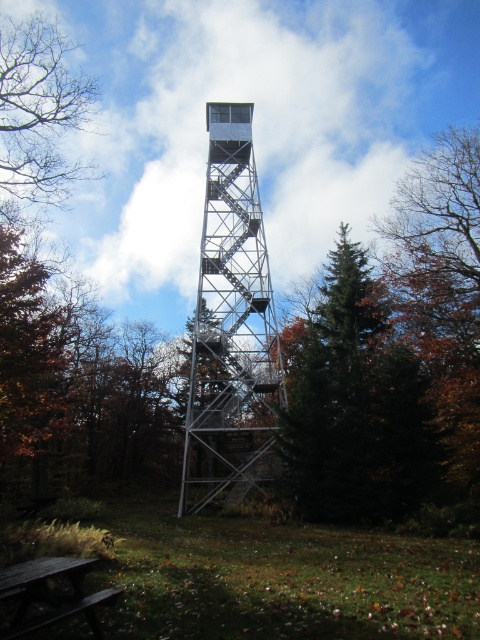
Is metallic silver tower at center above dark brown wooden picnic table at lower left?

Yes, metallic silver tower at center is above dark brown wooden picnic table at lower left.

Between metallic silver tower at center and dark brown wooden picnic table at lower left, which one is positioned lower?

→ dark brown wooden picnic table at lower left is below.

Is point (216, 392) positioned in front of point (97, 595)?

No, it is not.

Identify the location of metallic silver tower at center. Image resolution: width=480 pixels, height=640 pixels. (230, 324).

Measure the distance between metallic silver tower at center and bare branches at upper left.

metallic silver tower at center is 36.60 feet away from bare branches at upper left.

The width and height of the screenshot is (480, 640). What do you see at coordinates (230, 324) in the screenshot?
I see `metallic silver tower at center` at bounding box center [230, 324].

What do you see at coordinates (230, 324) in the screenshot? I see `metallic silver tower at center` at bounding box center [230, 324].

Where is `metallic silver tower at center`? Image resolution: width=480 pixels, height=640 pixels. metallic silver tower at center is located at coordinates (230, 324).

Based on the photo, does bare branches at upper left have a smaller size compared to dark brown wooden picnic table at lower left?

Actually, bare branches at upper left might be larger than dark brown wooden picnic table at lower left.

Is bare branches at upper left below dark brown wooden picnic table at lower left?

No, bare branches at upper left is not below dark brown wooden picnic table at lower left.

The height and width of the screenshot is (640, 480). Identify the location of bare branches at upper left. (37, 115).